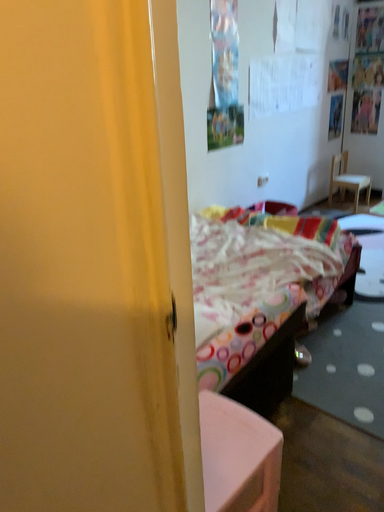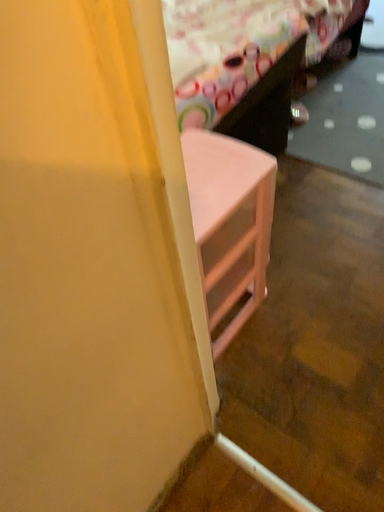
Question: Which way did the camera rotate in the video?

Choices:
 (A) rotated downward
 (B) rotated upward

Answer: (A)